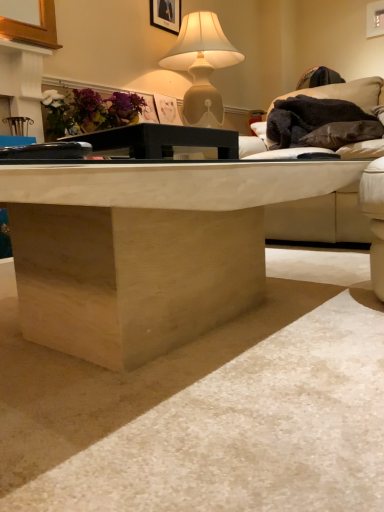
Describe the element at coordinates (319, 123) in the screenshot. This screenshot has height=512, width=384. I see `black fuzzy blanket at upper right` at that location.

Describe the element at coordinates (89, 112) in the screenshot. I see `matte floral arrangement at upper left` at that location.

In order to face matte beige lamp at upper center, should I rotate leftwards or rightwards?

You should look right and rotate roughly 1.590 degrees.

Measure the distance between point (164, 470) and camera.

Point (164, 470) and camera are 22.44 inches apart from each other.

Where is `black fuzzy blanket at upper right`? black fuzzy blanket at upper right is located at coordinates (319, 123).

Considering the positions of objects natural wood coffee table at center and black matte table at center in the image provided, who is in front, natural wood coffee table at center or black matte table at center?

natural wood coffee table at center is closer to the camera.

From the image's perspective, is natural wood coffee table at center on black matte table at center?

No, from the image's perspective, natural wood coffee table at center is not on top of black matte table at center.

From a real-world perspective, is natural wood coffee table at center physically below black matte table at center?

Yes, from a real-world perspective, natural wood coffee table at center is beneath black matte table at center.

Who is bigger, natural wood coffee table at center or black matte table at center?

natural wood coffee table at center.

Is matte beige lamp at upper center taller or shorter than natural wood coffee table at center?

In the image, matte beige lamp at upper center appears to be taller than natural wood coffee table at center.

Does matte beige lamp at upper center have a lesser width compared to natural wood coffee table at center?

Yes.

Where is `concrete to the right of matte beige lamp at upper center`? concrete to the right of matte beige lamp at upper center is located at coordinates (206, 416).

Which object is closer to the camera, matte beige lamp at upper center or natural wood coffee table at center?

natural wood coffee table at center is closer to the camera.

Where is `concrete in front of the matte floral arrangement at upper left`? The height and width of the screenshot is (512, 384). concrete in front of the matte floral arrangement at upper left is located at coordinates (206, 416).

Which is nearer, (112, 127) or (331, 330)?

Point (112, 127) appears to be farther away from the viewer than point (331, 330).

From a real-world perspective, is matte floral arrangement at upper left located higher than natural wood coffee table at center?

Yes, from a real-world perspective, matte floral arrangement at upper left is over natural wood coffee table at center

Between matte floral arrangement at upper left and natural wood coffee table at center, which one is positioned behind?

matte floral arrangement at upper left is behind.

Considering the positions of objects black matte table at center and natural wood coffee table at center in the image provided, who is more to the left, black matte table at center or natural wood coffee table at center?

black matte table at center is more to the left.

Which is nearer, [182,126] or [183,468]?

Point [182,126] appears to be farther away from the viewer than point [183,468].

In order to click on concrete lying in front of the black matte table at center in this screenshot , I will do `click(206, 416)`.

Can you confirm if black matte table at center is bigger than natural wood coffee table at center?

Actually, black matte table at center might be smaller than natural wood coffee table at center.

From the image's perspective, which is below, matte floral arrangement at upper left or matte black picture frame at upper center?

matte floral arrangement at upper left, from the image's perspective.

What's the angular difference between matte floral arrangement at upper left and matte black picture frame at upper center's facing directions?

The angle between the facing direction of matte floral arrangement at upper left and the facing direction of matte black picture frame at upper center is 0.799 degrees.

Are matte floral arrangement at upper left and matte black picture frame at upper center located far from each other?

matte floral arrangement at upper left is actually quite close to matte black picture frame at upper center.

Between matte floral arrangement at upper left and matte black picture frame at upper center, which one has larger width?

With larger width is matte floral arrangement at upper left.

Considering the relative sizes of matte floral arrangement at upper left and black matte table at center in the image provided, is matte floral arrangement at upper left bigger than black matte table at center?

Yes, matte floral arrangement at upper left is bigger than black matte table at center.

Looking at this image, from the image's perspective, between matte floral arrangement at upper left and black matte table at center, who is located below?

black matte table at center is shown below in the image.

Is matte floral arrangement at upper left thinner than black matte table at center?

Indeed, matte floral arrangement at upper left has a lesser width compared to black matte table at center.

Does matte black picture frame at upper center turn towards matte floral arrangement at upper left?

No, matte black picture frame at upper center is not aimed at matte floral arrangement at upper left.

Does matte black picture frame at upper center have a greater height compared to matte floral arrangement at upper left?

Yes, matte black picture frame at upper center is taller than matte floral arrangement at upper left.

From a real-world perspective, is matte black picture frame at upper center physically below matte floral arrangement at upper left?

Actually, matte black picture frame at upper center is physically above matte floral arrangement at upper left in the real world.

Based on the photo, does matte black picture frame at upper center touch matte floral arrangement at upper left?

No, matte black picture frame at upper center is not beside matte floral arrangement at upper left.

In order to click on table above the natural wood coffee table at center (from the image's perspective) in this screenshot , I will do `click(161, 140)`.

Where is `lamp lying on the left of natural wood coffee table at center`? lamp lying on the left of natural wood coffee table at center is located at coordinates (201, 66).

Estimate the real-world distances between objects in this image. Which object is further from black matte table at center, matte black picture frame at upper center or natural wood coffee table at center?

matte black picture frame at upper center is further to black matte table at center.

Estimate the real-world distances between objects in this image. Which object is further from matte black picture frame at upper center, matte floral arrangement at upper left or black matte table at center?

Among the two, black matte table at center is located further to matte black picture frame at upper center.

Based on their spatial positions, is natural wood coffee table at center or matte black picture frame at upper center closer to matte floral arrangement at upper left?

matte black picture frame at upper center is closer to matte floral arrangement at upper left.

When comparing their distances from black fuzzy blanket at upper right, does natural wood coffee table at center or matte beige lamp at upper center seem closer?

matte beige lamp at upper center.

When comparing their distances from matte beige lamp at upper center, does matte black picture frame at upper center or black fuzzy blanket at upper right seem closer?

matte black picture frame at upper center is positioned closer to the anchor matte beige lamp at upper center.

Which object lies nearer to the anchor point natural wood coffee table at center, matte black picture frame at upper center or matte beige lamp at upper center?

The object closer to natural wood coffee table at center is matte beige lamp at upper center.

Considering their positions, is matte beige lamp at upper center positioned further to matte floral arrangement at upper left than black fuzzy blanket at upper right?

black fuzzy blanket at upper right is further to matte floral arrangement at upper left.

Considering their positions, is natural wood coffee table at center positioned further to matte black picture frame at upper center than black fuzzy blanket at upper right?

The object further to matte black picture frame at upper center is natural wood coffee table at center.

The width and height of the screenshot is (384, 512). Identify the location of flower positioned between natural wood coffee table at center and black fuzzy blanket at upper right from near to far. (89, 112).

This screenshot has height=512, width=384. Identify the location of flower located between natural wood coffee table at center and matte beige lamp at upper center in the depth direction. (89, 112).

Locate an element on the screen. table between natural wood coffee table at center and matte black picture frame at upper center in the front-back direction is located at coordinates (161, 140).

Where is `material between black matte table at center and matte beige lamp at upper center along the z-axis`? material between black matte table at center and matte beige lamp at upper center along the z-axis is located at coordinates (319, 123).